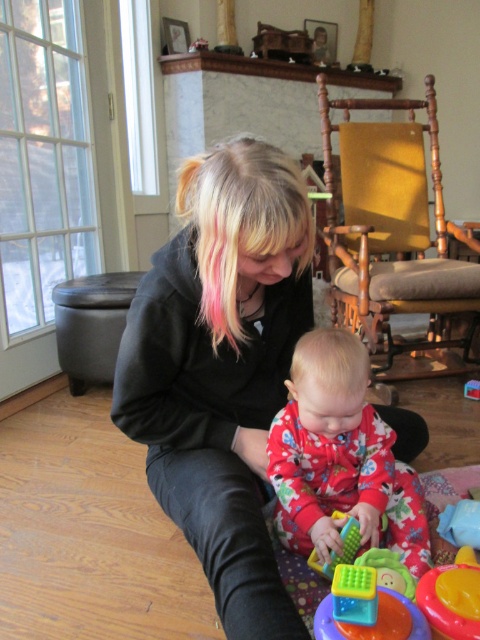
Based on the photo, you are a photographer trying to capture a candid shot of the adult and baby playing. You want to position your camera at point A and point B. Point A is at coordinates point[276,168] and point B is at coordinates point[120,298]. Which point would allow you to see both the adult and baby clearly without obstructions?

Point A at coordinates point[276,168] is in front of point B at coordinates point[120,298]. Since point A is closer to the subject, it would provide a clearer unobstructed view of both the adult and baby.

You are a photographer setting up a shoot in this room. You need to place a thin, lightweight prop between the blondehair at center and the dark gray fabric ottoman at left. Based on their sizes, which object should the prop be placed closer to?

The prop should be placed closer to the blondehair at center because it is thinner than the dark gray fabric ottoman at left.

You are a parent trying to reach the rubber yellow cup at lower right while sitting at the blondehair at center. Can you comfortably reach it without moving your body?

The distance between the blondehair at center and the rubber yellow cup at lower right is 25.67 inches, which is approximately 2.14 feet. Since the average comfortable reaching distance for an adult is about 2 feet, you can just barely reach it without moving your body.